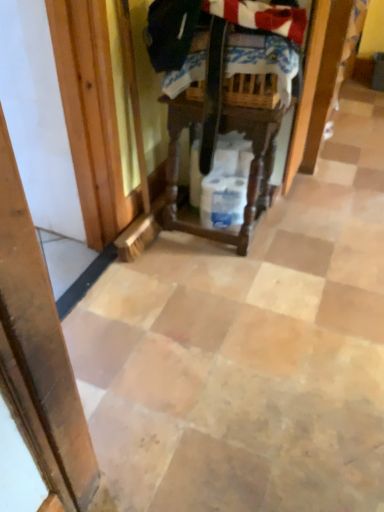
You are a GUI agent. You are given a task and a screenshot of the screen. Output one action in this format:
    pyautogui.click(x=<x>, y=<y>)
    Task: Click on the wooden table at center
    
    Given the screenshot: What is the action you would take?
    pyautogui.click(x=215, y=141)

Measure the distance between wooden table at center and camera.

wooden table at center is 4.36 feet from camera.

In order to face wooden table at center, should I rotate leftwards or rightwards?

A 4.197 degree turn to the right will do.

What do you see at coordinates (215, 141) in the screenshot?
I see `wooden table at center` at bounding box center [215, 141].

Identify the location of wooden table at center. (215, 141).